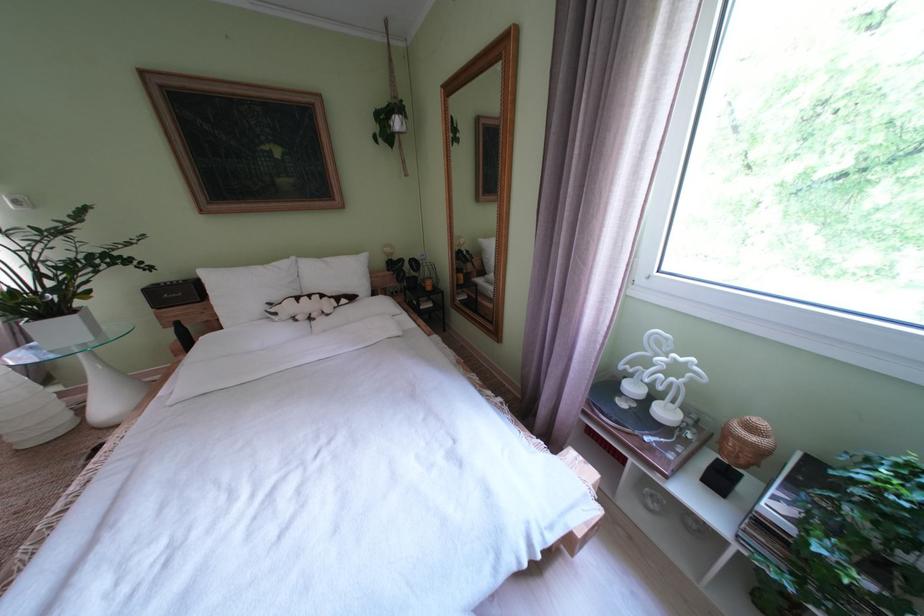
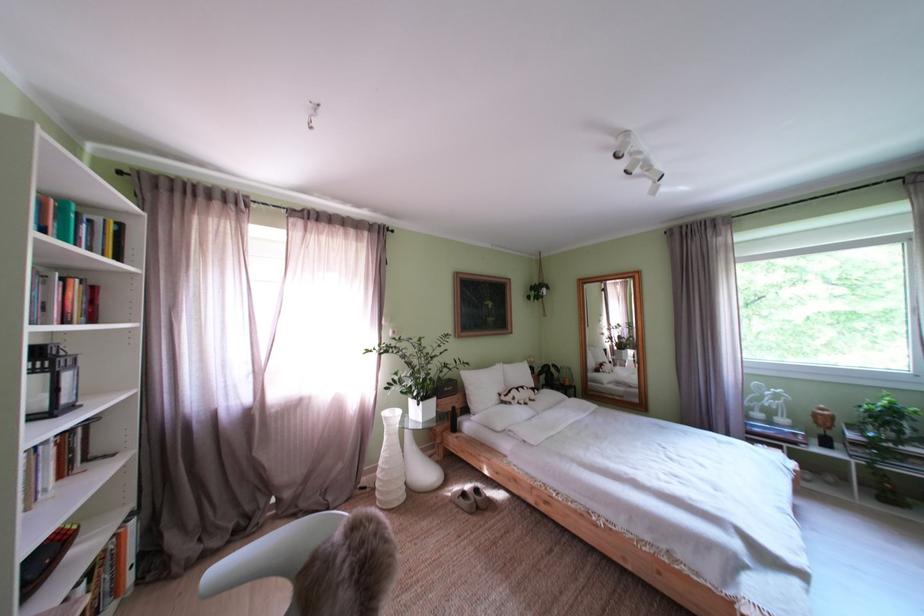
Question: I am providing you with two images of the same scene from different viewpoints. After the viewpoint changes to image2, which objects are now occluded?

Choices:
 (A) grey slipper
 (B) ceiling spotlight
 (C) large white vase
 (D) none of these

Answer: (D)